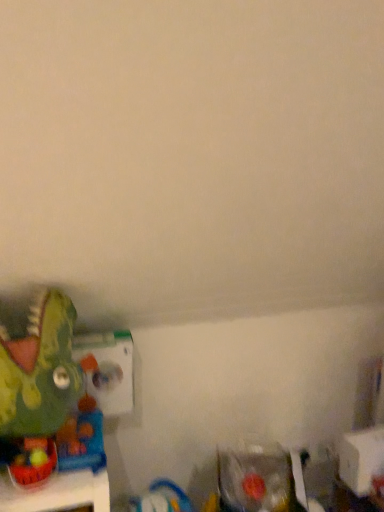
Question: Does green matte dinosaur at left, the 2th toy viewed from the left, appear on the left side of clear plastic toy at lower right, which ranks as the 3th toy in left-to-right order?

Choices:
 (A) no
 (B) yes

Answer: (B)

Question: Considering the relative sizes of green matte dinosaur at left, which appears as the 1th toy when viewed from the top, and clear plastic toy at lower right, which is the first toy in bottom-to-top order, in the image provided, is green matte dinosaur at left, which appears as the 1th toy when viewed from the top, bigger than clear plastic toy at lower right, which is the first toy in bottom-to-top order,?

Choices:
 (A) no
 (B) yes

Answer: (B)

Question: From the image's perspective, is green matte dinosaur at left, positioned as the 2th toy in right-to-left order, below clear plastic toy at lower right, marked as the 1th toy in a right-to-left arrangement?

Choices:
 (A) yes
 (B) no

Answer: (B)

Question: Does green matte dinosaur at left, positioned as the 2th toy in right-to-left order, appear on the right side of clear plastic toy at lower right, which is the first toy in bottom-to-top order?

Choices:
 (A) no
 (B) yes

Answer: (A)

Question: Is green matte dinosaur at left, which appears as the 1th toy when viewed from the top, turned away from clear plastic toy at lower right, the third toy in the top-to-bottom sequence?

Choices:
 (A) no
 (B) yes

Answer: (A)

Question: Is rubberized green dinosaur at lower left, the first toy in the left-to-right sequence, inside or outside of clear plastic toy at lower right, the third toy in the top-to-bottom sequence?

Choices:
 (A) inside
 (B) outside

Answer: (B)

Question: Considering the positions of rubberized green dinosaur at lower left, which is the 2th toy in top-to-bottom order, and clear plastic toy at lower right, which ranks as the 3th toy in left-to-right order, in the image, is rubberized green dinosaur at lower left, which is the 2th toy in top-to-bottom order, bigger or smaller than clear plastic toy at lower right, which ranks as the 3th toy in left-to-right order,?

Choices:
 (A) big
 (B) small

Answer: (B)

Question: Relative to clear plastic toy at lower right, the third toy in the top-to-bottom sequence, is rubberized green dinosaur at lower left, which is the 2th toy in top-to-bottom order, in front or behind?

Choices:
 (A) front
 (B) behind

Answer: (A)

Question: Considering the positions of rubberized green dinosaur at lower left, which ranks as the 2th toy in bottom-to-top order, and clear plastic toy at lower right, which is the first toy in bottom-to-top order, in the image, is rubberized green dinosaur at lower left, which ranks as the 2th toy in bottom-to-top order, wider or thinner than clear plastic toy at lower right, which is the first toy in bottom-to-top order,?

Choices:
 (A) wide
 (B) thin

Answer: (B)

Question: Visually, is rubberized green dinosaur at lower left, which is the 3th toy in right-to-left order, positioned to the left or to the right of green matte dinosaur at left, which appears as the third toy when ordered from the bottom?

Choices:
 (A) right
 (B) left

Answer: (B)

Question: Is rubberized green dinosaur at lower left, which is the 2th toy in top-to-bottom order, wider or thinner than green matte dinosaur at left, the 2th toy viewed from the left?

Choices:
 (A) wide
 (B) thin

Answer: (B)

Question: Is point (29, 441) closer or farther from the camera than point (34, 302)?

Choices:
 (A) closer
 (B) farther

Answer: (A)

Question: In the image, is rubberized green dinosaur at lower left, the first toy in the left-to-right sequence, positioned in front of or behind green matte dinosaur at left, which appears as the 1th toy when viewed from the top?

Choices:
 (A) behind
 (B) front

Answer: (A)

Question: From the image's perspective, is green matte dinosaur at left, which appears as the third toy when ordered from the bottom, above or below rubberized green dinosaur at lower left, which is the 2th toy in top-to-bottom order?

Choices:
 (A) below
 (B) above

Answer: (B)

Question: Based on their positions, is green matte dinosaur at left, the 2th toy viewed from the left, located to the left or right of rubberized green dinosaur at lower left, which ranks as the 2th toy in bottom-to-top order?

Choices:
 (A) right
 (B) left

Answer: (A)